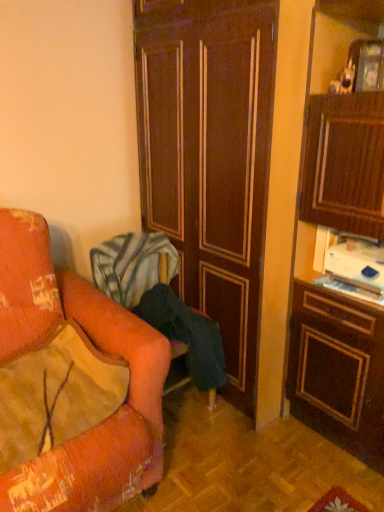
What do you see at coordinates (210, 157) in the screenshot? The width and height of the screenshot is (384, 512). I see `dark wood door at center` at bounding box center [210, 157].

Identify the location of velvet orange pillow at left. The width and height of the screenshot is (384, 512). (56, 394).

This screenshot has width=384, height=512. What are the coordinates of `dark wood door at center` in the screenshot? It's located at (210, 157).

Who is taller, dark wood door at center or velvet orange chair at left?

dark wood door at center.

Considering the relative sizes of dark wood door at center and velvet orange chair at left in the image provided, is dark wood door at center bigger than velvet orange chair at left?

Correct, dark wood door at center is larger in size than velvet orange chair at left.

In order to click on pillow in front of the dark wood door at center in this screenshot , I will do `click(56, 394)`.

Considering the relative sizes of dark wood door at center and velvet orange pillow at left in the image provided, is dark wood door at center thinner than velvet orange pillow at left?

Incorrect, the width of dark wood door at center is not less than that of velvet orange pillow at left.

Is point (210, 181) closer or farther from the camera than point (70, 435)?

Point (210, 181) is positioned farther from the camera compared to point (70, 435).

Between velvet orange pillow at left and dark wood door at center, which one is positioned behind?

Positioned behind is dark wood door at center.

In the scene shown: Is velvet orange pillow at left to the right of dark wood door at center from the viewer's perspective?

Incorrect, velvet orange pillow at left is not on the right side of dark wood door at center.

Is dark wood door at center surrounded by velvet orange pillow at left?

No, dark wood door at center is not a part of velvet orange pillow at left.

Is velvet orange pillow at left looking in the opposite direction of dark wood door at center?

No, velvet orange pillow at left is not facing the opposite direction of dark wood door at center.

From a real-world perspective, is velvet orange chair at left below velvet orange pillow at left?

Indeed, from a real-world perspective, velvet orange chair at left is positioned beneath velvet orange pillow at left.

Locate an element on the screen. pillow in front of the velvet orange chair at left is located at coordinates (56, 394).

Which is more distant, (168, 280) or (63, 416)?

The point (168, 280) is behind.

Is velvet orange chair at left placed right next to velvet orange pillow at left?

No, velvet orange chair at left is not in contact with velvet orange pillow at left.

Between velvet orange chair at left and dark wood door at center, which one has smaller size?

Smaller between the two is velvet orange chair at left.

Which object is positioned more to the right, velvet orange chair at left or dark wood door at center?

Positioned to the right is dark wood door at center.

In the scene shown: Does velvet orange chair at left have a lesser height compared to dark wood door at center?

Yes.

From the image's perspective, between velvet orange chair at left and dark wood door at center, who is located below?

velvet orange chair at left appears lower in the image.

Which object is closer to the camera taking this photo, velvet orange pillow at left or velvet orange chair at left?

Positioned in front is velvet orange pillow at left.

Which point is more distant from viewer, (99, 403) or (121, 273)?

The point (121, 273) is farther from the camera.

Between velvet orange pillow at left and velvet orange chair at left, which one has larger size?

velvet orange chair at left.

What are the coordinates of `door above the velvet orange chair at left (from the image's perspective)` in the screenshot? It's located at (210, 157).

Locate an element on the screen. This screenshot has width=384, height=512. door on the right of velvet orange pillow at left is located at coordinates tap(210, 157).

Which object lies further to the anchor point dark wood door at center, velvet orange chair at left or velvet orange pillow at left?

velvet orange pillow at left is positioned further to the anchor dark wood door at center.

Considering their positions, is velvet orange chair at left positioned further to velvet orange pillow at left than dark wood door at center?

dark wood door at center is further to velvet orange pillow at left.

Which object lies further to the anchor point velvet orange chair at left, velvet orange pillow at left or dark wood door at center?

velvet orange pillow at left is further to velvet orange chair at left.

Based on their spatial positions, is dark wood door at center or velvet orange pillow at left closer to velvet orange chair at left?

Among the two, dark wood door at center is located nearer to velvet orange chair at left.

From the image, which object appears to be nearer to dark wood door at center, velvet orange pillow at left or velvet orange chair at left?

Among the two, velvet orange chair at left is located nearer to dark wood door at center.

Looking at the image, which one is located closer to velvet orange pillow at left, dark wood door at center or velvet orange chair at left?

Among the two, velvet orange chair at left is located nearer to velvet orange pillow at left.

Locate an element on the screen. chair that lies between dark wood door at center and velvet orange pillow at left from top to bottom is located at coordinates click(133, 264).